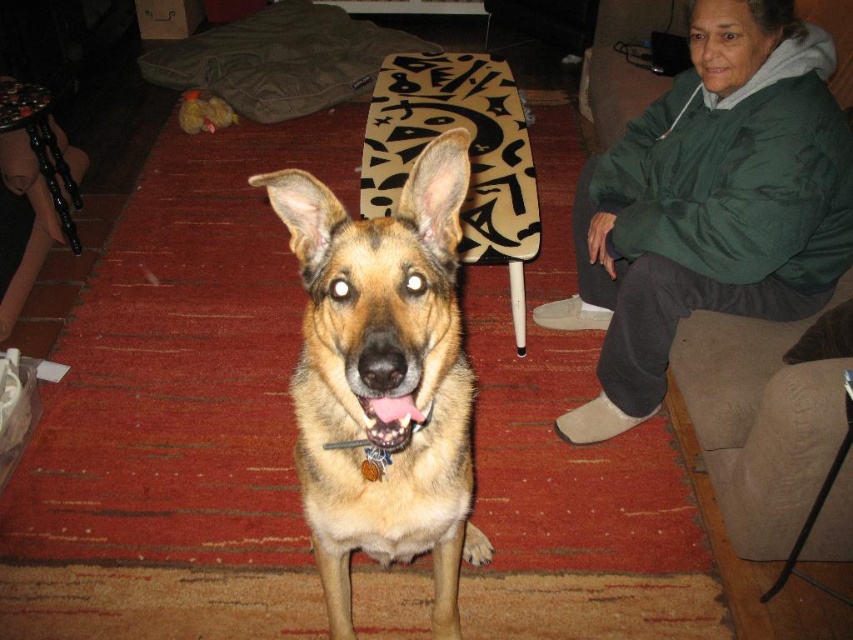
You are a photographer standing in front of the golden fur dog at center and the green fleece jacket at upper right. Which object is closer to you?

The green fleece jacket at upper right is closer to you because it is further to the viewer than the golden fur dog at center.

You are a service robot in the room. You need to deliver a small package to the person wearing the green fleece jacket at upper right. The package is 0.5 meters wide. The path from your current position to the jacket is blocked by the German Shepherd dog sitting on the red carpeted floor. The dog is at the pink glossy teeth at center. Can you navigate around the dog to reach the jacket without getting too close? Explain your plan.

The green fleece jacket at upper right is 1.22 meters away from the pink glossy teeth at center. Since the package is 0.5 meters wide, you can navigate around the dog by maintaining a distance of at least 0.75 meters from the dog to ensure safety. This allows you to reach the jacket without obstruction.

You are a photographer trying to capture a photo of the golden fur dog at center. You notice the green fleece jacket at upper right might be distracting in the frame. Which direction should you move your camera to eliminate the jacket from the shot?

A: To eliminate the green fleece jacket at upper right from the frame, move the camera to the left since the green fleece jacket at upper right is positioned to the right of the golden fur dog at center.